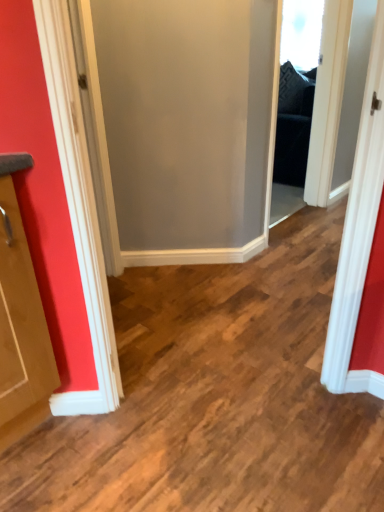
Identify the location of free spot in front of black fabric screen door at upper right. The image size is (384, 512). pyautogui.click(x=294, y=257).